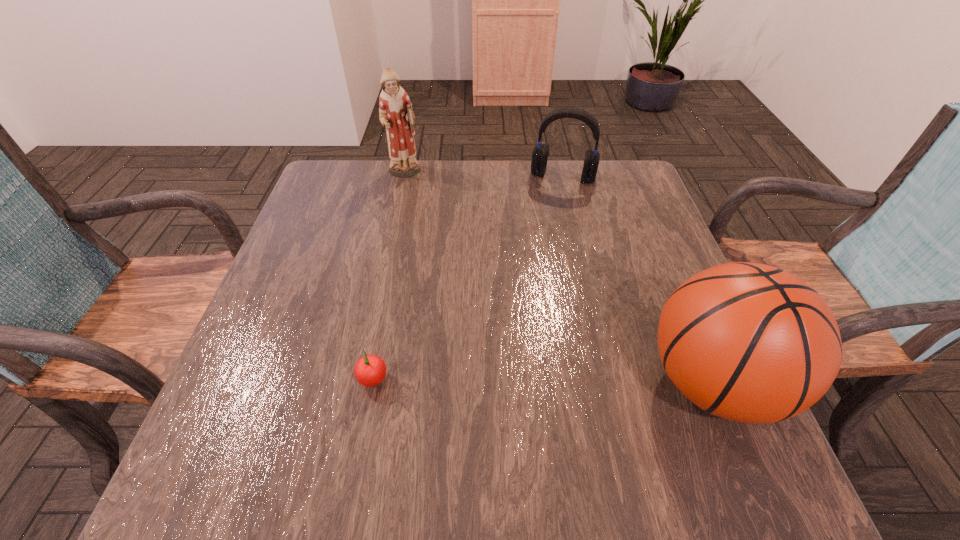
This screenshot has height=540, width=960. What are the coordinates of `vacant spot on the desktop that is between the shortest object and the basketball and is positioned on the headband of the headset` in the screenshot? It's located at (511, 383).

Locate an element on the screen. The height and width of the screenshot is (540, 960). vacant space on the desktop that is between the shortest object and the basketball and is positioned on the front-facing side of the figurine is located at coordinates (503, 383).